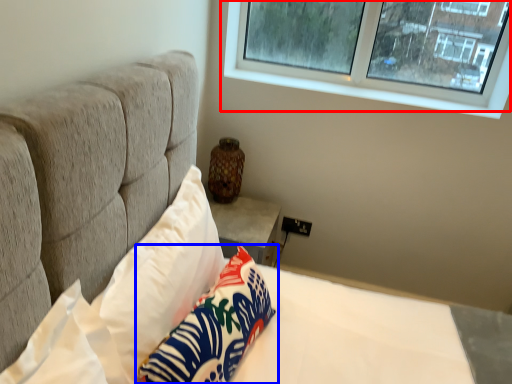
Question: Which of the following is the closest to the observer, window (highlighted by a red box) or pillow (highlighted by a blue box)?

Choices:
 (A) window
 (B) pillow

Answer: (B)